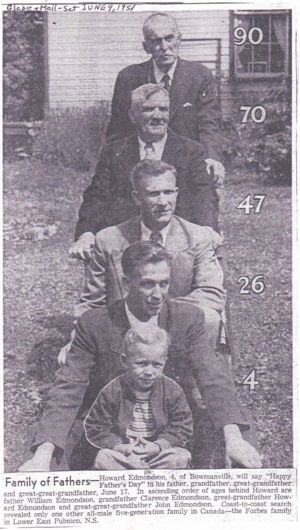
This screenshot has height=530, width=300. In order to click on window curtains in this screenshot , I will do `click(279, 21)`, `click(245, 15)`.